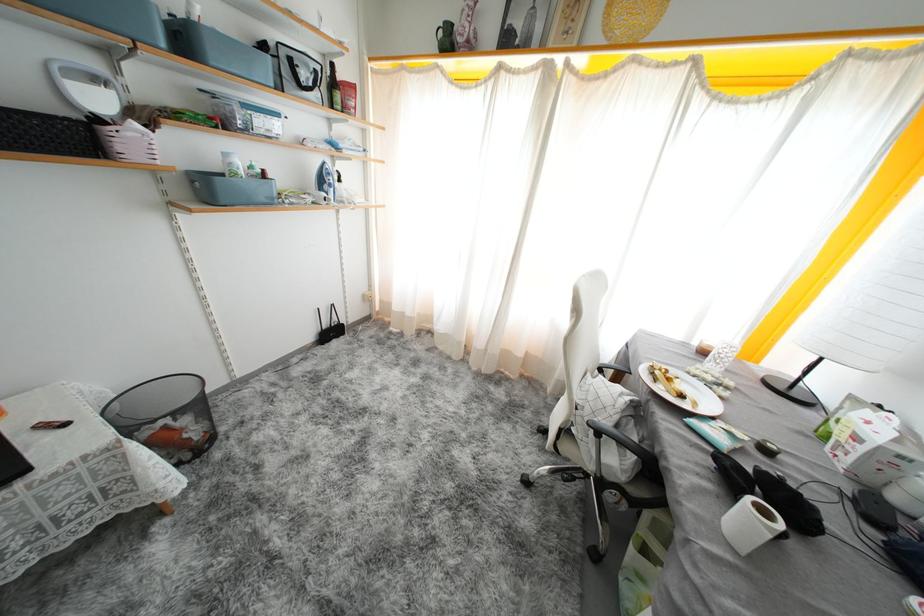
The image size is (924, 616). Identify the location of black bag handle. (734, 475).